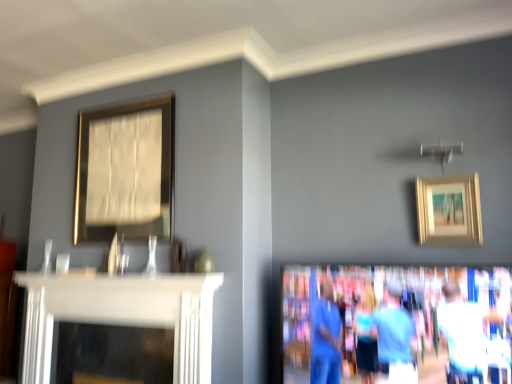
Question: Relative to gold/golden frame at upper right, the first picture frame from the front, is gold metallic picture frame at upper left, the second picture frame in the front-to-back sequence, in front or behind?

Choices:
 (A) behind
 (B) front

Answer: (A)

Question: From a real-world perspective, is gold metallic picture frame at upper left, which ranks as the second picture frame in right-to-left order, above or below gold/golden frame at upper right, which ranks as the 1th picture frame in right-to-left order?

Choices:
 (A) below
 (B) above

Answer: (B)

Question: Which of these objects is positioned closest to the gold metallic picture frame at upper left, the first picture frame in the left-to-right sequence?

Choices:
 (A) gold/golden frame at upper right, positioned as the 2th picture frame in back-to-front order
 (B) white glossy fireplace at left
 (C) blue fabric couple at lower right

Answer: (B)

Question: Estimate the real-world distances between objects in this image. Which object is farther from the gold/golden frame at upper right, positioned as the 2th picture frame in back-to-front order?

Choices:
 (A) blue fabric couple at lower right
 (B) white glossy fireplace at left
 (C) gold metallic picture frame at upper left, the second picture frame in the front-to-back sequence

Answer: (C)